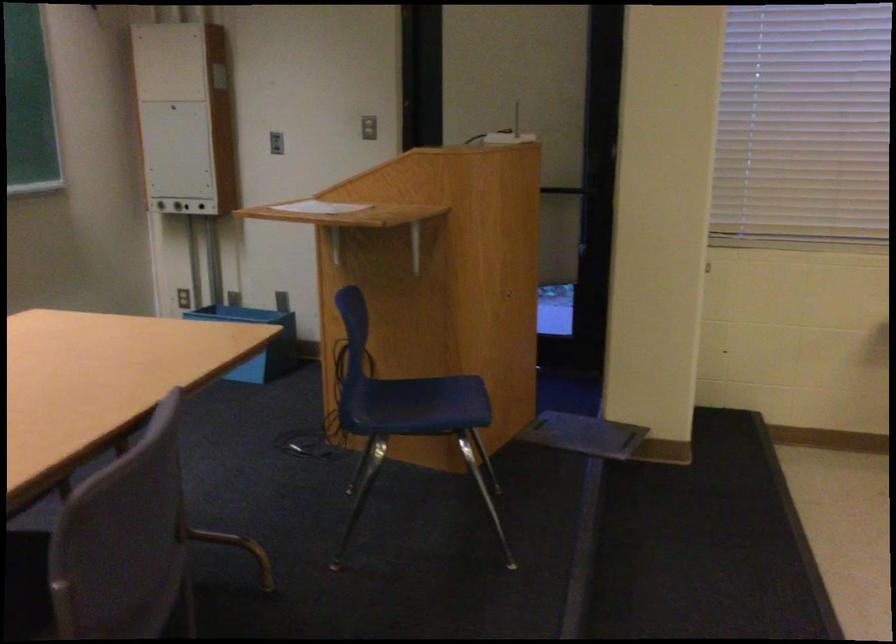
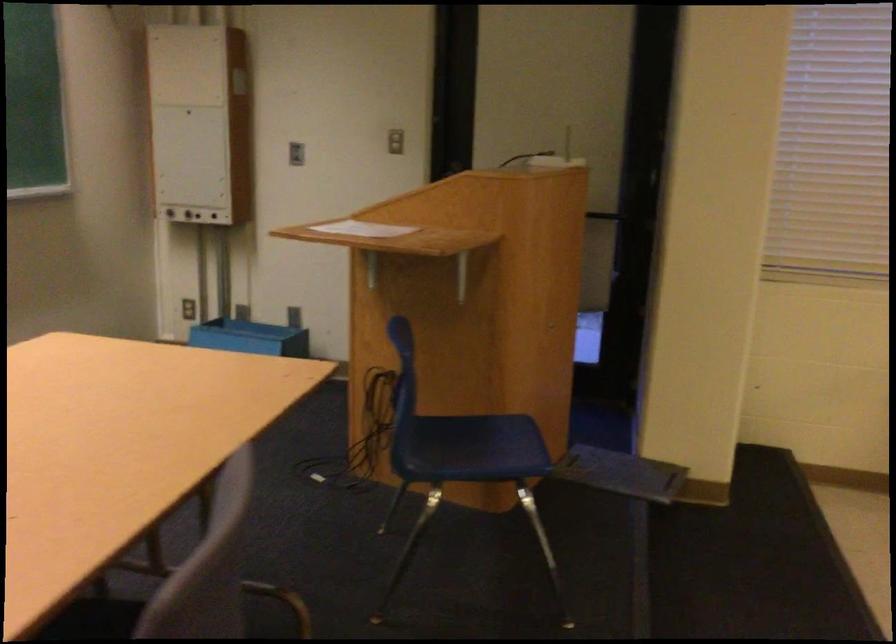
Where in the second image is the point corresponding to the point at 240,321 from the first image?

(250, 337)